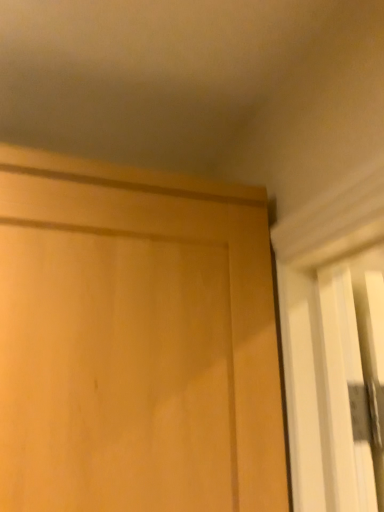
The height and width of the screenshot is (512, 384). I want to click on light wood door at center, so click(135, 342).

Describe the element at coordinates (135, 342) in the screenshot. I see `light wood door at center` at that location.

The width and height of the screenshot is (384, 512). I want to click on light wood door at center, so click(x=135, y=342).